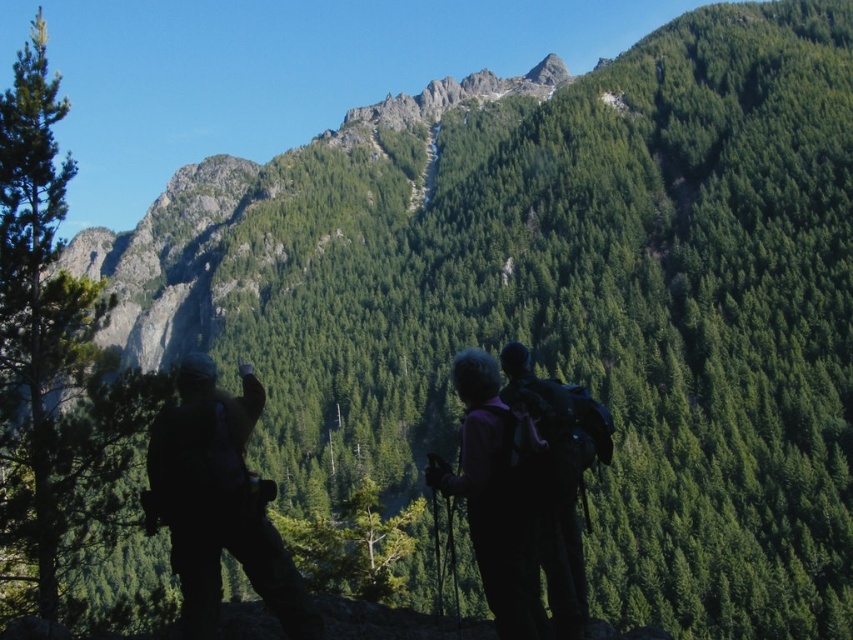
You are a photographer planning to take a photo of the green textured tree at left from your current position. The camera you are using has a maximum focus range of 120 feet. Will you be able to capture the tree in focus without moving closer?

The green textured tree at left and camera are 125.44 feet apart from each other. Since the maximum focus range of the camera is 120 feet, the distance is beyond the camera capabilities. Therefore, you will not be able to capture the tree in focus without moving closer.

In the scene shown: You are a photographer planning to take a photo of the green textured tree at left. Based on its position, where should you aim your camera in the image?

The green textured tree at left is located at the 2D coordinates point (54, 360) in the image, so you should aim your camera at that point to capture it.